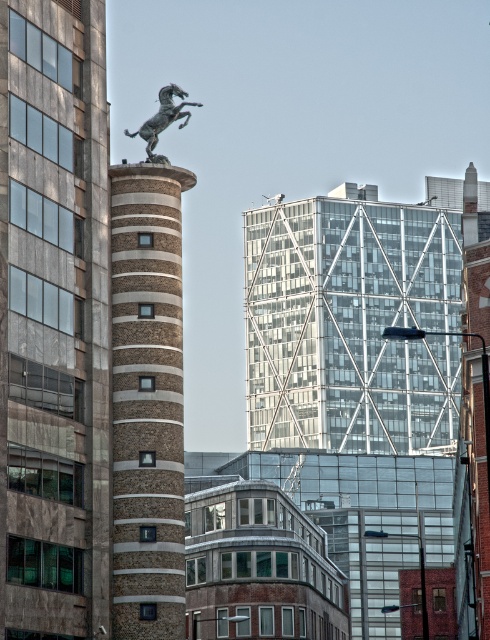
You are an architect analyzing the urban layout. Given that the transparent glass building at center and the brown brick tower at center are both in the same row, which one would cast a wider shadow during midday?

The transparent glass building at center has a larger width than the brown brick tower at center, so it would cast a wider shadow during midday.